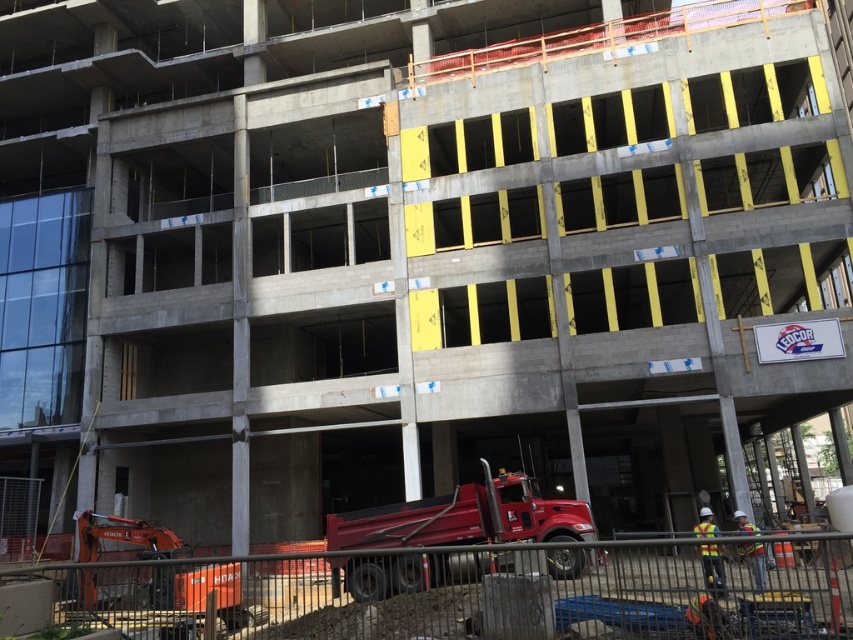
You are a construction worker standing at the entrance of the construction site. You see the shiny red truck at center and the reflective yellow safety vest at lower center. Which object is closer to you?

The shiny red truck at center is closer to you because it is further to the viewer than the reflective yellow safety vest at lower center.

You are a construction worker who needs to transport a large piece of equipment that requires a vehicle wider than the reflective safety vest at center. Can the shiny red truck at center accommodate the equipment?

The shiny red truck at center is wider than the reflective safety vest at center, so it can accommodate the equipment that requires a vehicle wider than the reflective safety vest at center.

You are an inspector standing at the entrance of the construction site. You need to locate the reflective yellow safety vest at lower center. According to the coordinates provided, where should you look relative to the construction crane and dump truck?

The reflective yellow safety vest at lower center is located at coordinates point (712, 568). Since the construction crane is on the left and the dump truck is in the foreground near the construction area, the safety vest is positioned closer to the lower right portion of the image, near the dump truck but slightly to the right of the crane.